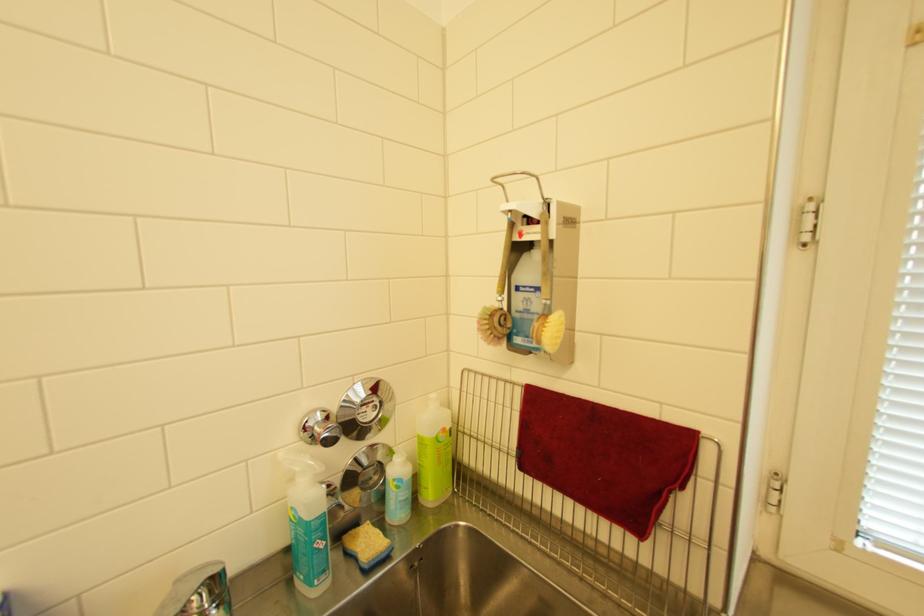
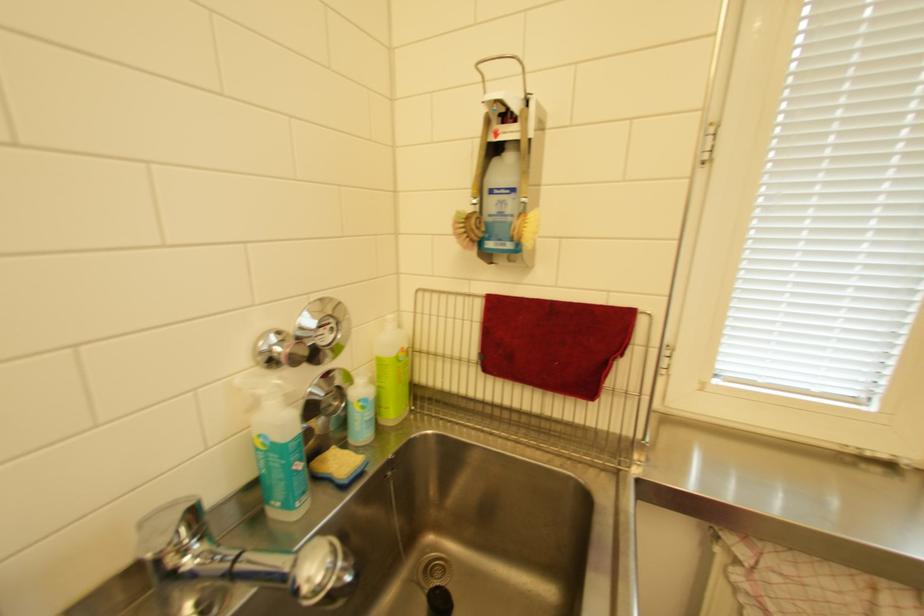
In the second image, find the point that corresponds to point 560,243 in the first image.

(537, 140)